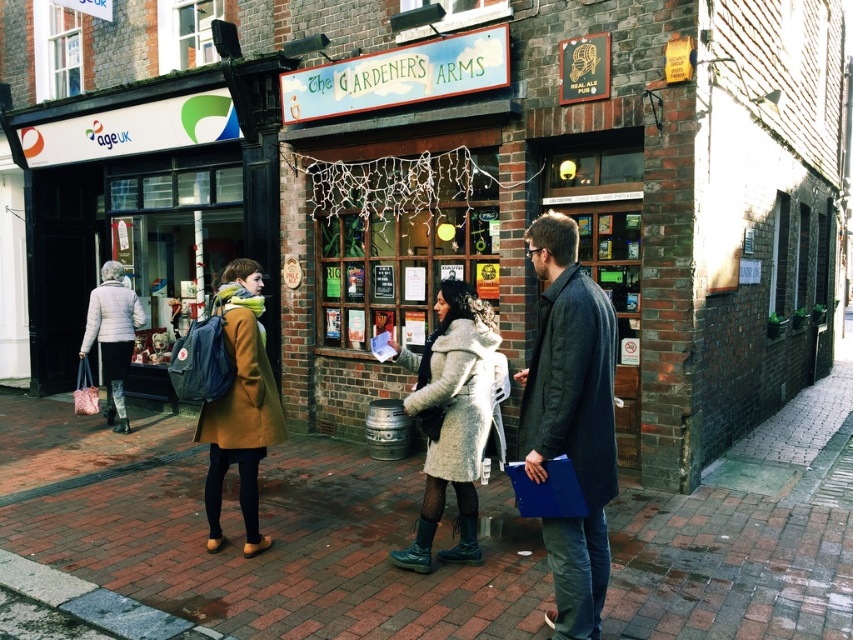
From the picture: Is fluffy beige coat at center wider than white quilted jacket at left?

No.

Between fluffy beige coat at center and white quilted jacket at left, which one appears on the right side from the viewer's perspective?

From the viewer's perspective, fluffy beige coat at center appears more on the right side.

Is point (569, 378) closer to viewer compared to point (126, 362)?

Yes, point (569, 378) is closer to viewer.

The width and height of the screenshot is (853, 640). Identify the location of fluffy beige coat at center. (572, 419).

Which is more to the left, dark gray woolen jacket at center or fuzzy white coat at center?

fuzzy white coat at center is more to the left.

Is point (566, 310) closer to camera compared to point (457, 410)?

Yes, point (566, 310) is in front of point (457, 410).

I want to click on dark gray woolen jacket at center, so click(x=572, y=419).

Does fluffy beige coat at center appear on the left side of dark gray woolen jacket at center?

In fact, fluffy beige coat at center is to the right of dark gray woolen jacket at center.

Which is more to the right, fluffy beige coat at center or dark gray woolen jacket at center?

From the viewer's perspective, fluffy beige coat at center appears more on the right side.

Locate an element on the screen. The image size is (853, 640). fluffy beige coat at center is located at coordinates (572, 419).